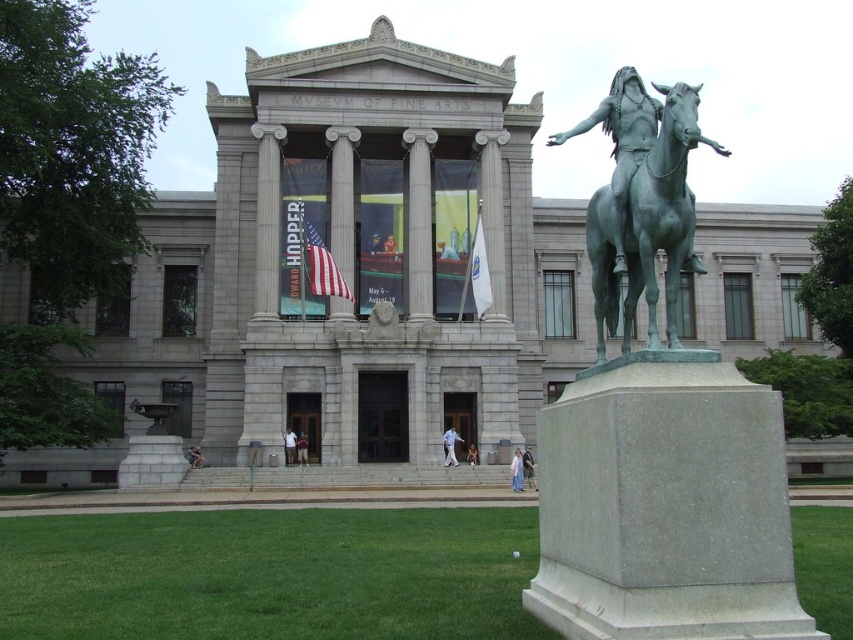
What is located at the coordinates point [450,445]?

Light blue jeans at center is located at point [450,445].

You are an artist observing the scene at the Museum of Fine Arts. You notice two people dressed in light blue jeans at center and a pink fabric dress at lower center. Which person is wearing clothing with a smaller area?

The light blue jeans at center is smaller than the pink fabric dress at lower center, so the person wearing the light blue jeans at center has clothing with a smaller area.

What is located at the coordinates point (450,445) in the image?

Light blue jeans at center is located at point (450,445).